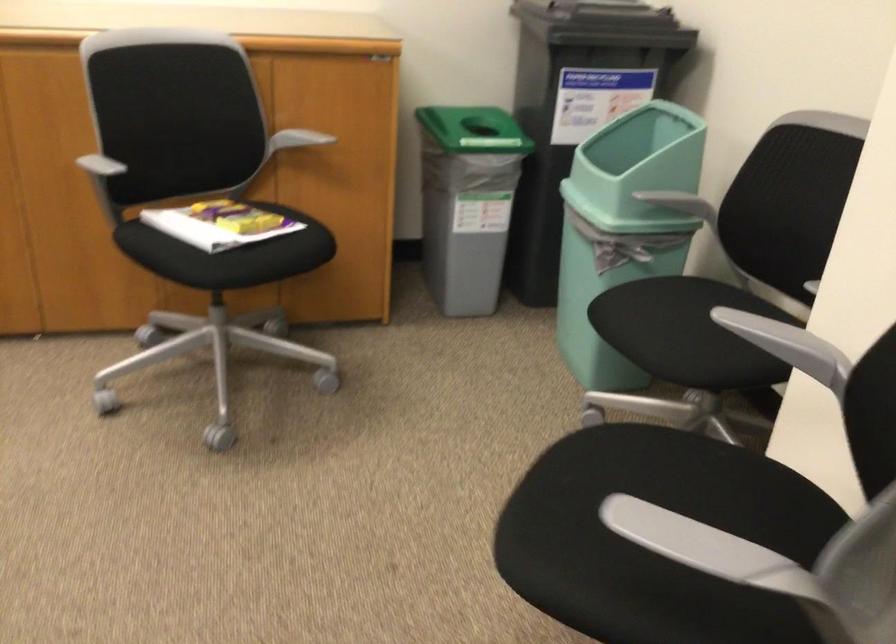
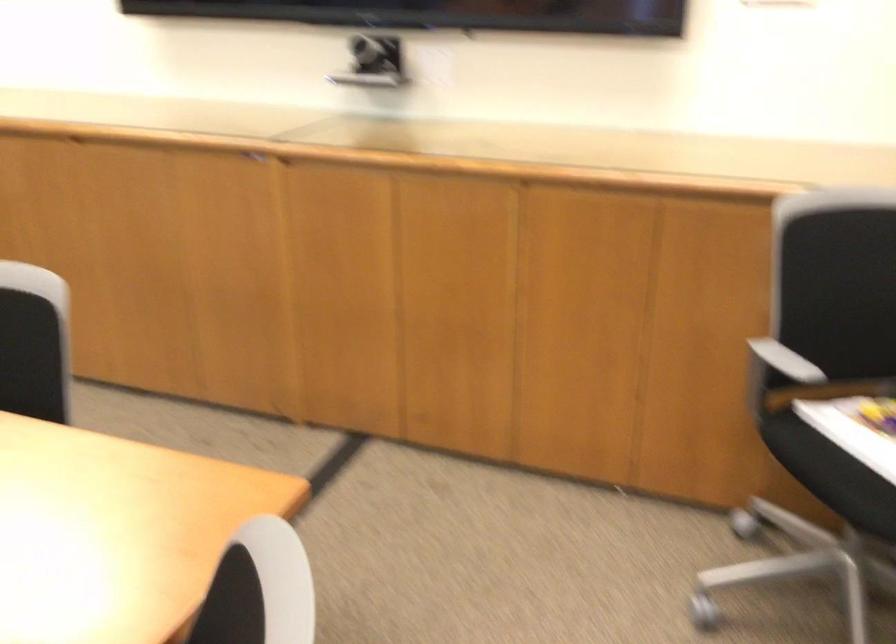
Where in the second image is the point corresponding to [190,225] from the first image?

(857, 442)